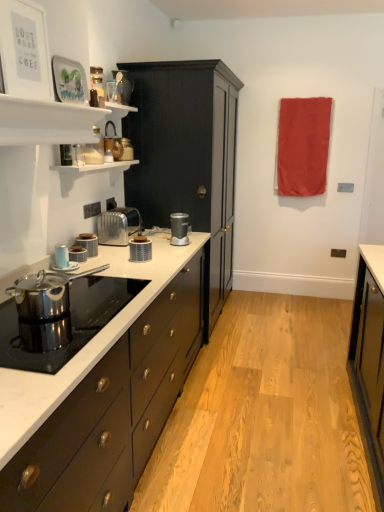
Question: Is satin silver toaster at center at the right side of metallic copper kettle at upper center, placed as the second appliance when sorted from bottom to top?

Choices:
 (A) yes
 (B) no

Answer: (B)

Question: From the image's perspective, is satin silver toaster at center under metallic copper kettle at upper center, the 3th appliance in the front-to-back sequence?

Choices:
 (A) no
 (B) yes

Answer: (B)

Question: Can you confirm if satin silver toaster at center is thinner than metallic copper kettle at upper center, the second appliance positioned from the top?

Choices:
 (A) no
 (B) yes

Answer: (A)

Question: From the image's perspective, is satin silver toaster at center above metallic copper kettle at upper center, placed as the second appliance when sorted from bottom to top?

Choices:
 (A) yes
 (B) no

Answer: (B)

Question: From a real-world perspective, is satin silver toaster at center located higher than metallic copper kettle at upper center, the 3th appliance in the front-to-back sequence?

Choices:
 (A) yes
 (B) no

Answer: (B)

Question: Choose the correct answer: Is white marble countertop at center inside matte blue cup at left, which ranks as the fifth kitchen appliance in right-to-left order, or outside it?

Choices:
 (A) inside
 (B) outside

Answer: (B)

Question: Considering the positions of white marble countertop at center and matte blue cup at left, which ranks as the 1th kitchen appliance in front-to-back order, in the image, is white marble countertop at center bigger or smaller than matte blue cup at left, which ranks as the 1th kitchen appliance in front-to-back order,?

Choices:
 (A) small
 (B) big

Answer: (B)

Question: Considering the positions of white marble countertop at center and matte blue cup at left, which ranks as the 1th kitchen appliance in front-to-back order, in the image, is white marble countertop at center wider or thinner than matte blue cup at left, which ranks as the 1th kitchen appliance in front-to-back order,?

Choices:
 (A) thin
 (B) wide

Answer: (B)

Question: Is point (188, 362) positioned closer to the camera than point (61, 260)?

Choices:
 (A) farther
 (B) closer

Answer: (A)

Question: From a real-world perspective, is matte black cabinet at center physically located above or below satin silver toaster at center?

Choices:
 (A) above
 (B) below

Answer: (A)

Question: Looking at their shapes, would you say matte black cabinet at center is wider or thinner than satin silver toaster at center?

Choices:
 (A) thin
 (B) wide

Answer: (B)

Question: In the image, is matte black cabinet at center on the left side or the right side of satin silver toaster at center?

Choices:
 (A) left
 (B) right

Answer: (B)

Question: In terms of height, does matte black cabinet at center look taller or shorter compared to satin silver toaster at center?

Choices:
 (A) tall
 (B) short

Answer: (A)

Question: From their relative heights in the image, would you say metallic silver toaster at upper left, marked as the third appliance in a top-to-bottom arrangement, is taller or shorter than white glossy shelves at upper left?

Choices:
 (A) tall
 (B) short

Answer: (A)

Question: Is point (84, 150) closer or farther from the camera than point (18, 102)?

Choices:
 (A) farther
 (B) closer

Answer: (A)